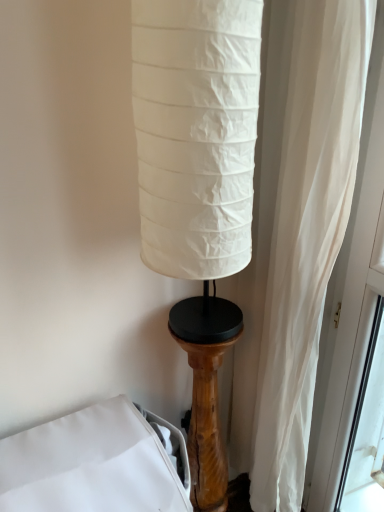
Question: Should I look upward or downward to see white fabric bed at lower left?

Choices:
 (A) down
 (B) up

Answer: (A)

Question: Is white fabric bed at lower left smaller than wooden pedestal at lower right?

Choices:
 (A) no
 (B) yes

Answer: (A)

Question: From a real-world perspective, is white fabric bed at lower left on wooden pedestal at lower right?

Choices:
 (A) yes
 (B) no

Answer: (B)

Question: Is white fabric bed at lower left shorter than wooden pedestal at lower right?

Choices:
 (A) yes
 (B) no

Answer: (A)

Question: From the image's perspective, does white fabric bed at lower left appear higher than wooden pedestal at lower right?

Choices:
 (A) no
 (B) yes

Answer: (A)

Question: Is white fabric bed at lower left positioned far away from wooden pedestal at lower right?

Choices:
 (A) no
 (B) yes

Answer: (A)

Question: From a real-world perspective, is white fabric bed at lower left positioned under wooden pedestal at lower right based on gravity?

Choices:
 (A) no
 (B) yes

Answer: (B)

Question: Is wooden pedestal at lower right positioned before white fabric bed at lower left?

Choices:
 (A) yes
 (B) no

Answer: (B)

Question: From a real-world perspective, is wooden pedestal at lower right over white fabric bed at lower left?

Choices:
 (A) yes
 (B) no

Answer: (A)

Question: From the image's perspective, is wooden pedestal at lower right located beneath white fabric bed at lower left?

Choices:
 (A) no
 (B) yes

Answer: (A)

Question: Does wooden pedestal at lower right have a greater width compared to white fabric bed at lower left?

Choices:
 (A) yes
 (B) no

Answer: (B)

Question: Can you confirm if wooden pedestal at lower right is taller than white fabric bed at lower left?

Choices:
 (A) yes
 (B) no

Answer: (A)

Question: Considering the relative sizes of wooden pedestal at lower right and white fabric bed at lower left in the image provided, is wooden pedestal at lower right thinner than white fabric bed at lower left?

Choices:
 (A) yes
 (B) no

Answer: (A)

Question: From the image's perspective, is white fabric bed at lower left positioned above or below wooden pedestal at lower right?

Choices:
 (A) above
 (B) below

Answer: (B)